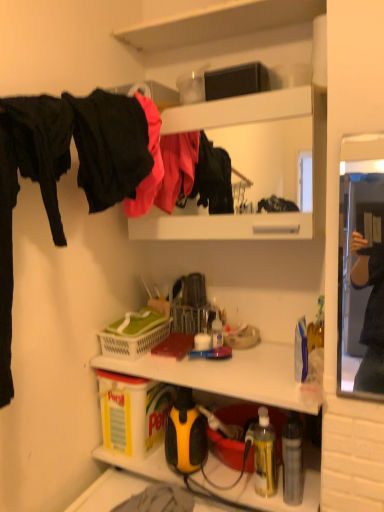
Question: Considering the relative sizes of translucent yellow bottle at lower right, marked as the first bottle in a left-to-right arrangement, and yellow/black plastic sprayer at lower center in the image provided, is translucent yellow bottle at lower right, marked as the first bottle in a left-to-right arrangement, shorter than yellow/black plastic sprayer at lower center?

Choices:
 (A) no
 (B) yes

Answer: (A)

Question: Is translucent yellow bottle at lower right, marked as the first bottle in a left-to-right arrangement, thinner than yellow/black plastic sprayer at lower center?

Choices:
 (A) no
 (B) yes

Answer: (B)

Question: Is the position of translucent yellow bottle at lower right, marked as the first bottle in a left-to-right arrangement, less distant than that of yellow/black plastic sprayer at lower center?

Choices:
 (A) yes
 (B) no

Answer: (B)

Question: Is translucent yellow bottle at lower right, marked as the first bottle in a left-to-right arrangement, outside of yellow/black plastic sprayer at lower center?

Choices:
 (A) yes
 (B) no

Answer: (A)

Question: Considering the relative sizes of translucent yellow bottle at lower right, which is the 2th bottle in right-to-left order, and yellow/black plastic sprayer at lower center in the image provided, is translucent yellow bottle at lower right, which is the 2th bottle in right-to-left order, wider than yellow/black plastic sprayer at lower center?

Choices:
 (A) no
 (B) yes

Answer: (A)

Question: Does translucent yellow bottle at lower right, marked as the first bottle in a left-to-right arrangement, have a smaller size compared to yellow/black plastic sprayer at lower center?

Choices:
 (A) no
 (B) yes

Answer: (B)

Question: Considering the relative sizes of white plastic picnic basket at center and yellow plastic box at lower left, positioned as the 2th box in right-to-left order, in the image provided, is white plastic picnic basket at center bigger than yellow plastic box at lower left, positioned as the 2th box in right-to-left order,?

Choices:
 (A) yes
 (B) no

Answer: (B)

Question: Is the position of white plastic picnic basket at center less distant than that of yellow plastic box at lower left, the second box in the top-to-bottom sequence?

Choices:
 (A) no
 (B) yes

Answer: (A)

Question: Does white plastic picnic basket at center have a greater width compared to yellow plastic box at lower left, the second box in the top-to-bottom sequence?

Choices:
 (A) yes
 (B) no

Answer: (A)

Question: Considering the relative sizes of white plastic picnic basket at center and yellow plastic box at lower left, placed as the first box when sorted from left to right, in the image provided, is white plastic picnic basket at center taller than yellow plastic box at lower left, placed as the first box when sorted from left to right,?

Choices:
 (A) yes
 (B) no

Answer: (B)

Question: Is white plastic picnic basket at center thinner than yellow plastic box at lower left, placed as the first box when sorted from left to right?

Choices:
 (A) no
 (B) yes

Answer: (A)

Question: From a real-world perspective, is white plastic picnic basket at center located beneath yellow plastic box at lower left, placed as the first box when sorted from left to right?

Choices:
 (A) yes
 (B) no

Answer: (B)

Question: Is yellow plastic box at lower left, placed as the first box when sorted from bottom to top, facing away from white plastic picnic basket at center?

Choices:
 (A) no
 (B) yes

Answer: (A)